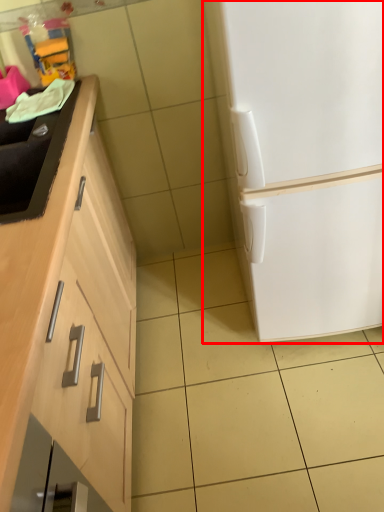
Question: From the image's perspective, where is refrigerator (annotated by the red box) located in relation to sink in the image?

Choices:
 (A) below
 (B) above

Answer: (B)